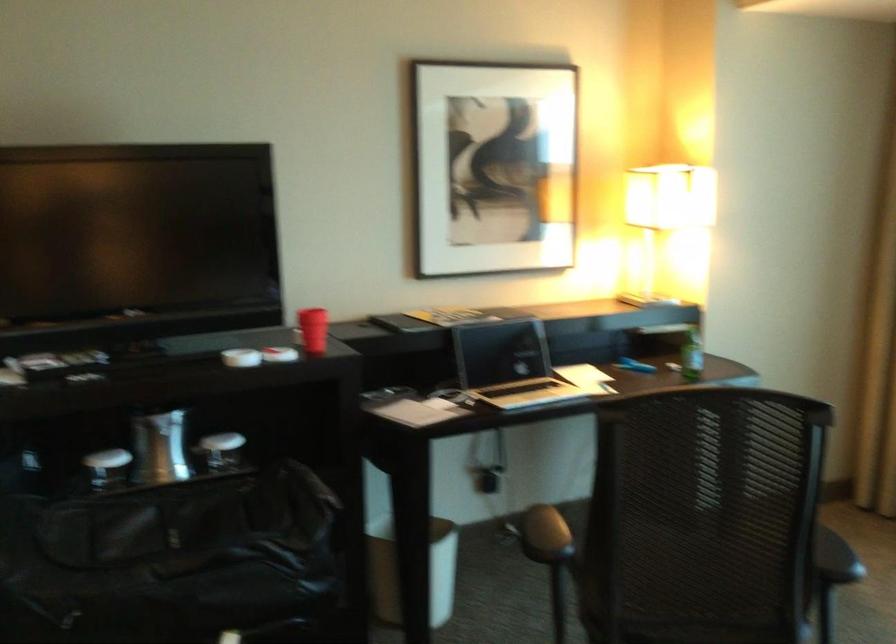
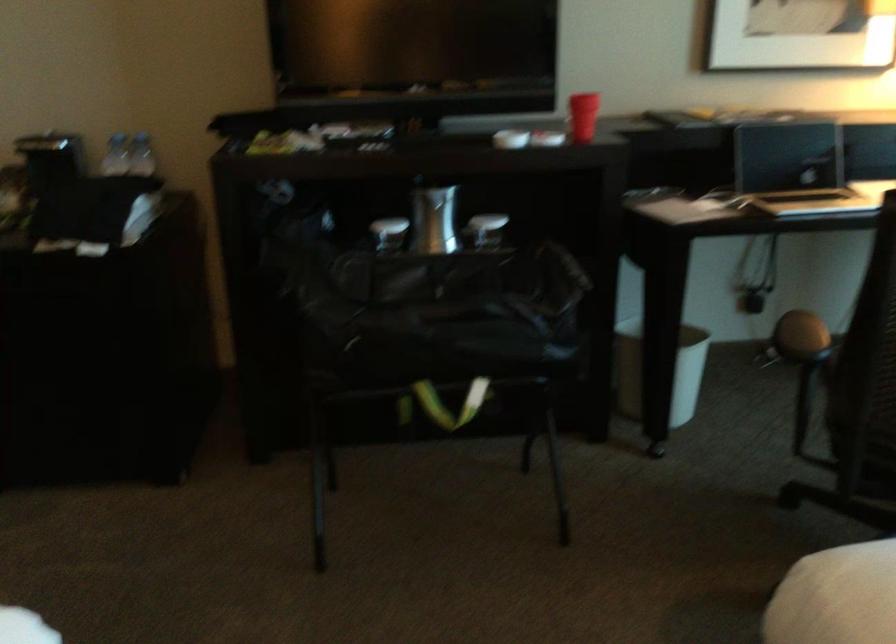
The point at (315, 328) is marked in the first image. Where is the corresponding point in the second image?

(582, 116)